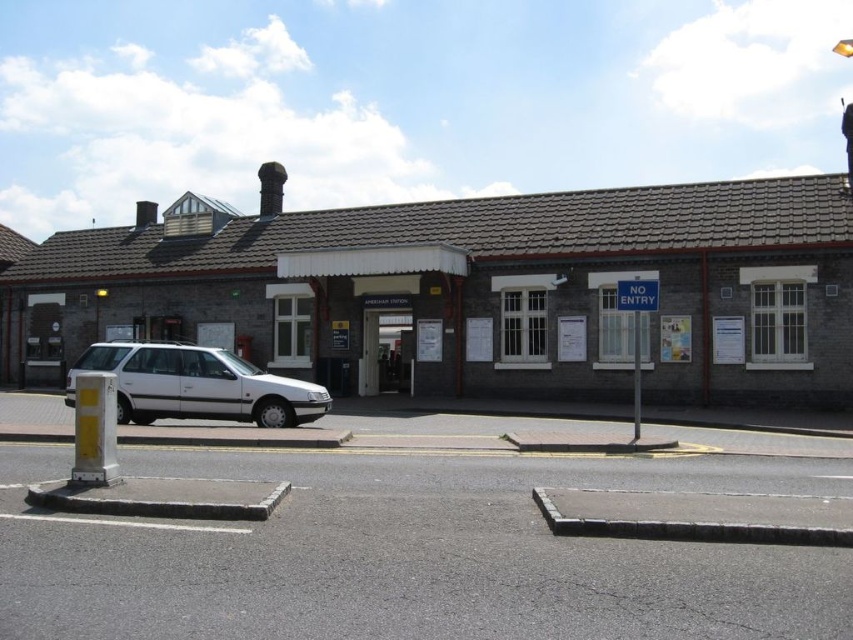
Question: Can you confirm if white matte car at center is wider than blue plastic sign at center?

Choices:
 (A) no
 (B) yes

Answer: (B)

Question: In this image, where is white matte car at center located relative to blue plastic sign at center?

Choices:
 (A) right
 (B) left

Answer: (B)

Question: Can you confirm if white matte car at center is positioned above blue plastic sign at center?

Choices:
 (A) no
 (B) yes

Answer: (A)